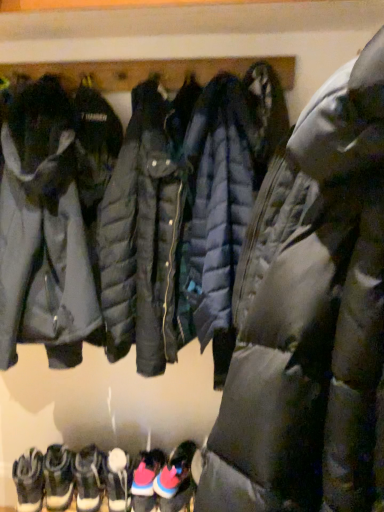
Question: Can you confirm if white fuzzy socks at lower left, which is counted as the 6th footwear, starting from the right, is shorter than white suede boots at lower left, the 2th footwear in the left-to-right sequence?

Choices:
 (A) no
 (B) yes

Answer: (B)

Question: Can we say white fuzzy socks at lower left, which is counted as the 6th footwear, starting from the right, lies outside white suede boots at lower left, the fifth footwear when ordered from right to left?

Choices:
 (A) no
 (B) yes

Answer: (B)

Question: From the image's perspective, is white fuzzy socks at lower left, which is counted as the 6th footwear, starting from the right, beneath white suede boots at lower left, the 2th footwear in the left-to-right sequence?

Choices:
 (A) yes
 (B) no

Answer: (A)

Question: Can you confirm if white fuzzy socks at lower left, the first footwear positioned from the left, is bigger than white suede boots at lower left, the 2th footwear in the left-to-right sequence?

Choices:
 (A) no
 (B) yes

Answer: (B)

Question: Considering the relative sizes of white fuzzy socks at lower left, the first footwear positioned from the left, and white suede boots at lower left, the fifth footwear when ordered from right to left, in the image provided, is white fuzzy socks at lower left, the first footwear positioned from the left, thinner than white suede boots at lower left, the fifth footwear when ordered from right to left,?

Choices:
 (A) no
 (B) yes

Answer: (A)

Question: Considering the positions of matte black jacket at left, the first jacket in the back-to-front sequence, and pink suede sneakers at lower center, the second footwear viewed from the right, in the image, is matte black jacket at left, the first jacket in the back-to-front sequence, bigger or smaller than pink suede sneakers at lower center, the second footwear viewed from the right,?

Choices:
 (A) small
 (B) big

Answer: (B)

Question: From a real-world perspective, relative to pink suede sneakers at lower center, the fifth footwear positioned from the left, is matte black jacket at left, the second jacket from the right, vertically above or below?

Choices:
 (A) above
 (B) below

Answer: (A)

Question: Is matte black jacket at left, positioned as the 1th jacket in left-to-right order, spatially inside pink suede sneakers at lower center, the fifth footwear positioned from the left, or outside of it?

Choices:
 (A) outside
 (B) inside

Answer: (A)

Question: Is point [x=14, y=138] closer or farther from the camera than point [x=135, y=494]?

Choices:
 (A) closer
 (B) farther

Answer: (A)

Question: From a real-world perspective, is white suede boots at lower left, the fifth footwear when ordered from right to left, above or below matte black puffer jacket at center, which appears as the first jacket when viewed from the right?

Choices:
 (A) below
 (B) above

Answer: (A)

Question: Considering their positions, is white suede boots at lower left, the 2th footwear in the left-to-right sequence, located in front of or behind matte black puffer jacket at center, which appears as the first jacket when viewed from the right?

Choices:
 (A) behind
 (B) front

Answer: (A)

Question: From their relative heights in the image, would you say white suede boots at lower left, the 2th footwear in the left-to-right sequence, is taller or shorter than matte black puffer jacket at center, arranged as the 1th jacket when viewed from the front?

Choices:
 (A) tall
 (B) short

Answer: (B)

Question: Considering the positions of white suede boots at lower left, the 2th footwear in the left-to-right sequence, and matte black puffer jacket at center, arranged as the 1th jacket when viewed from the front, in the image, is white suede boots at lower left, the 2th footwear in the left-to-right sequence, wider or thinner than matte black puffer jacket at center, arranged as the 1th jacket when viewed from the front,?

Choices:
 (A) wide
 (B) thin

Answer: (B)

Question: Is white leather sneakers at lower left, which ranks as the 3th footwear in left-to-right order, in front of or behind pink suede sneakers at lower center, which appears as the 1th footwear when viewed from the right, in the image?

Choices:
 (A) front
 (B) behind

Answer: (B)

Question: Looking at the image, does white leather sneakers at lower left, arranged as the 4th footwear when viewed from the right, seem bigger or smaller compared to pink suede sneakers at lower center, the sixth footwear from the left?

Choices:
 (A) big
 (B) small

Answer: (B)